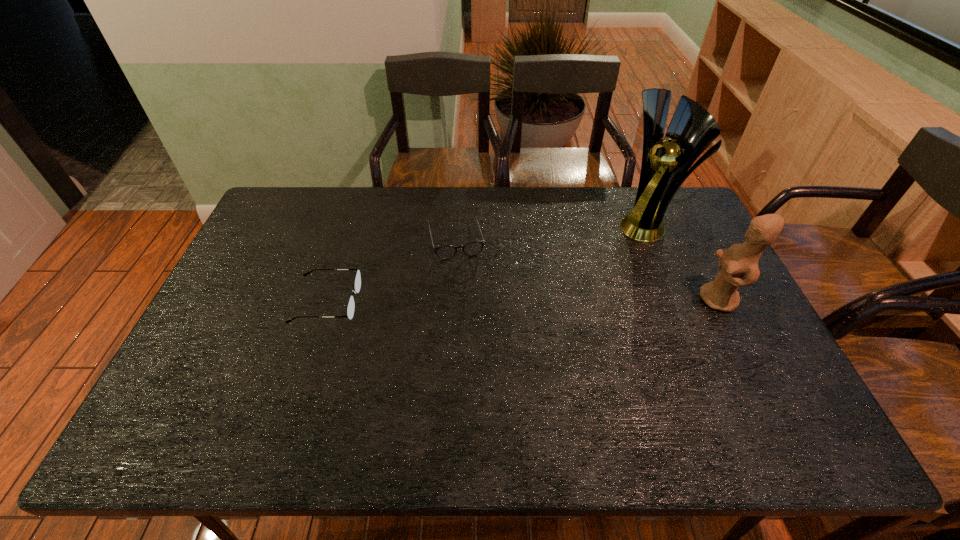
Where is `the leftmost object`? the leftmost object is located at coordinates (357, 282).

At what (x,y) coordinates should I click in order to perform the action: click on the nearer spectacles. Please return your answer as a coordinate pair (x, y). This screenshot has width=960, height=540. Looking at the image, I should click on click(357, 282).

The height and width of the screenshot is (540, 960). Identify the location of the third shortest object. (739, 260).

The width and height of the screenshot is (960, 540). What are the coordinates of `award` in the screenshot? It's located at (665, 165).

Identify the location of the farther spectacles. (445, 252).

Locate an element on the screen. This screenshot has height=540, width=960. the second object from left to right is located at coordinates (445, 252).

Where is `free spot located 0.320m on the lenses of the leftmost object`? The width and height of the screenshot is (960, 540). free spot located 0.320m on the lenses of the leftmost object is located at coordinates (470, 302).

Find the location of a particular element. This screenshot has width=960, height=540. vacant space situated on the front-facing side of the figurine is located at coordinates (606, 299).

Where is `blank area located on the front-facing side of the figurine`? blank area located on the front-facing side of the figurine is located at coordinates tap(591, 299).

The image size is (960, 540). In order to click on free space located on the front-facing side of the figurine in this screenshot , I will do coord(578,299).